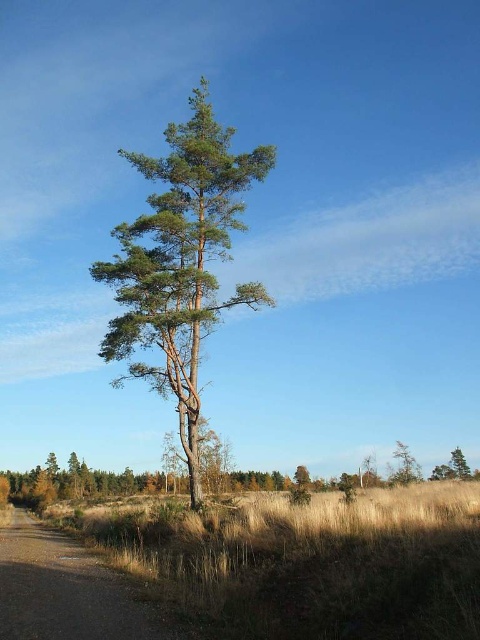
Does green textured pine tree at center appear over green matte tree at lower right?

Yes, green textured pine tree at center is above green matte tree at lower right.

Does green textured pine tree at center have a lesser width compared to green matte tree at lower right?

Yes, green textured pine tree at center is thinner than green matte tree at lower right.

Is point (182, 168) closer to camera compared to point (396, 468)?

Yes, point (182, 168) is closer to viewer.

You are a GUI agent. You are given a task and a screenshot of the screen. Output one action in this format:
    pyautogui.click(x=<x>, y=<y>)
    Task: Click on the green textured pine tree at center
    The image size is (480, 640).
    Given the screenshot: What is the action you would take?
    pyautogui.click(x=180, y=260)

Does point (291, 557) lie behind point (10, 557)?

No, (291, 557) is closer to viewer.

Describe the element at coordinates (309, 563) in the screenshot. The image size is (480, 640). I see `brown grass at lower center` at that location.

I want to click on brown grass at lower center, so click(x=309, y=563).

Who is positioned more to the left, brown grass at lower center or green matte tree at lower right?

From the viewer's perspective, brown grass at lower center appears more on the left side.

Can you confirm if brown grass at lower center is bigger than green matte tree at lower right?

No.

Which is behind, point (235, 579) or point (400, 442)?

Point (400, 442)

You are a GUI agent. You are given a task and a screenshot of the screen. Output one action in this format:
    pyautogui.click(x=<x>, y=<y>)
    Task: Click on the brown grass at lower center
    This screenshot has height=640, width=480.
    Given the screenshot: What is the action you would take?
    pyautogui.click(x=309, y=563)